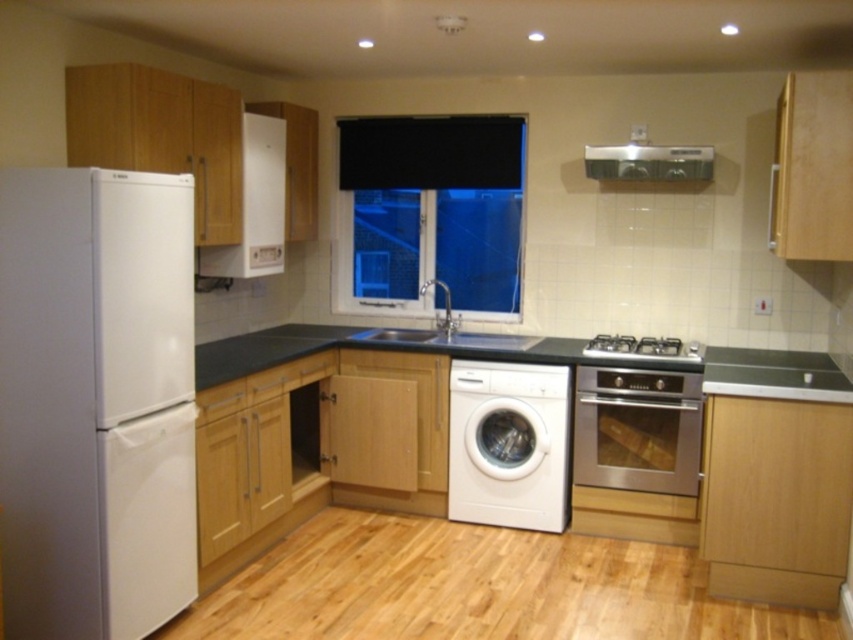
You are a delivery person who needs to place a new microwave on the counter between the stainless steel oven at lower right and the stainless steel gas stove at center right. Can you fit it there?

The stainless steel oven at lower right is to the left of the stainless steel gas stove at center right, so there is space between them for the microwave.

You are standing in the kitchen and want to clean both the black matte window at center and the satin silver metallic exhaust hood at upper center. Which one should you clean first if you want to start with the one closer to you?

You should clean the black matte window at center first because it is closer to you than the satin silver metallic exhaust hood at upper center.